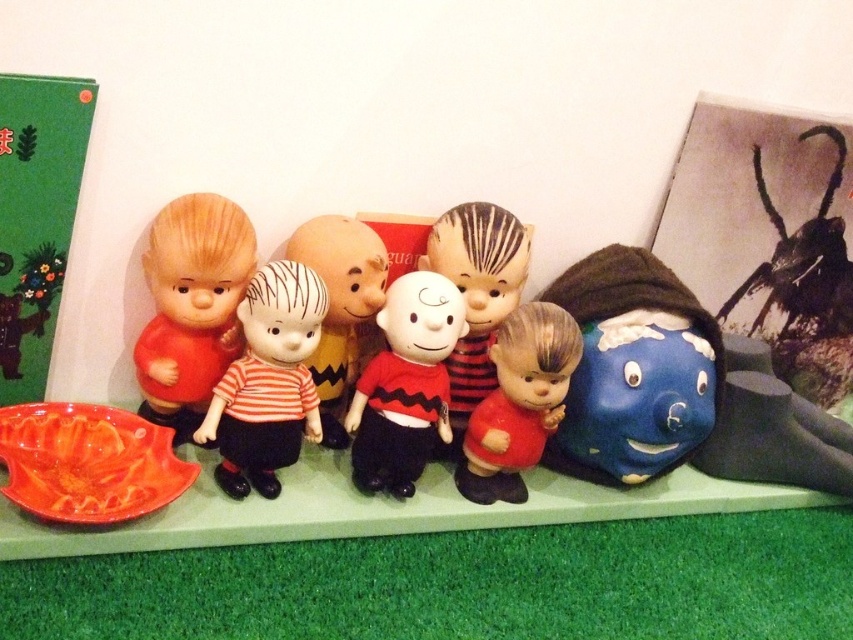
You are a small toy car that is 6 inches long. You want to drive from the matte plastic doll at left to the matte orange platter at lower left. Can you fit through the space between them without going around?

The distance between the matte plastic doll at left and the matte orange platter at lower left is 6.48 inches, which is slightly larger than the toy car. Therefore, the toy car can fit through the space between them without needing to go around.

You are organizing a display of Peanuts figurines on a shelf. You have a matte orange platter at lower left that you want to move to the right. Is there enough space to move it 10 centimeters to the right without overlapping any other objects?

The matte orange platter at lower left is located at point (88, 461). Since the coordinates indicate its position, moving it 10 centimeters to the right would depend on the available space. However, without knowing the dimensions of the shelf or the positions of other objects, it is impossible to determine if there is enough space. Please check the layout of the shelf and ensure there are no obstructions before moving the platter.

Consider the image. You are organizing a display of Peanuts figurines. You have a striped fabric doll at center and a matte plastic Charlie Brown at center. Which figurine is positioned closer to the front of the display?

The striped fabric doll at center is closer to the viewer than the matte plastic Charlie Brown at center, so it is positioned closer to the front of the display.